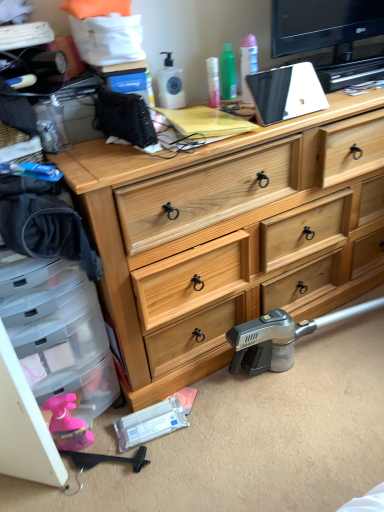
Question: Can you confirm if black plastic hammer at lower left is taller than natural wood chest of drawers at center?

Choices:
 (A) no
 (B) yes

Answer: (A)

Question: Considering the relative sizes of black plastic hammer at lower left and natural wood chest of drawers at center in the image provided, is black plastic hammer at lower left wider than natural wood chest of drawers at center?

Choices:
 (A) yes
 (B) no

Answer: (B)

Question: Is black plastic hammer at lower left placed right next to natural wood chest of drawers at center?

Choices:
 (A) no
 (B) yes

Answer: (A)

Question: Does black plastic hammer at lower left appear on the right side of natural wood chest of drawers at center?

Choices:
 (A) yes
 (B) no

Answer: (B)

Question: Is black plastic hammer at lower left outside of natural wood chest of drawers at center?

Choices:
 (A) yes
 (B) no

Answer: (A)

Question: From the image's perspective, is black plastic hammer at lower left above natural wood chest of drawers at center?

Choices:
 (A) no
 (B) yes

Answer: (A)

Question: Considering the relative sizes of natural wood chest of drawers at center and black plastic hammer at lower left in the image provided, is natural wood chest of drawers at center bigger than black plastic hammer at lower left?

Choices:
 (A) yes
 (B) no

Answer: (A)

Question: Does natural wood chest of drawers at center turn towards black plastic hammer at lower left?

Choices:
 (A) yes
 (B) no

Answer: (B)

Question: Considering the relative sizes of natural wood chest of drawers at center and black plastic hammer at lower left in the image provided, is natural wood chest of drawers at center shorter than black plastic hammer at lower left?

Choices:
 (A) no
 (B) yes

Answer: (A)

Question: Is natural wood chest of drawers at center beside black plastic hammer at lower left?

Choices:
 (A) no
 (B) yes

Answer: (A)

Question: Is natural wood chest of drawers at center smaller than black plastic hammer at lower left?

Choices:
 (A) yes
 (B) no

Answer: (B)

Question: Is natural wood chest of drawers at center oriented away from black plastic hammer at lower left?

Choices:
 (A) no
 (B) yes

Answer: (A)

Question: Relative to black plastic hammer at lower left, is natural wood chest of drawers at center in front or behind?

Choices:
 (A) behind
 (B) front

Answer: (B)